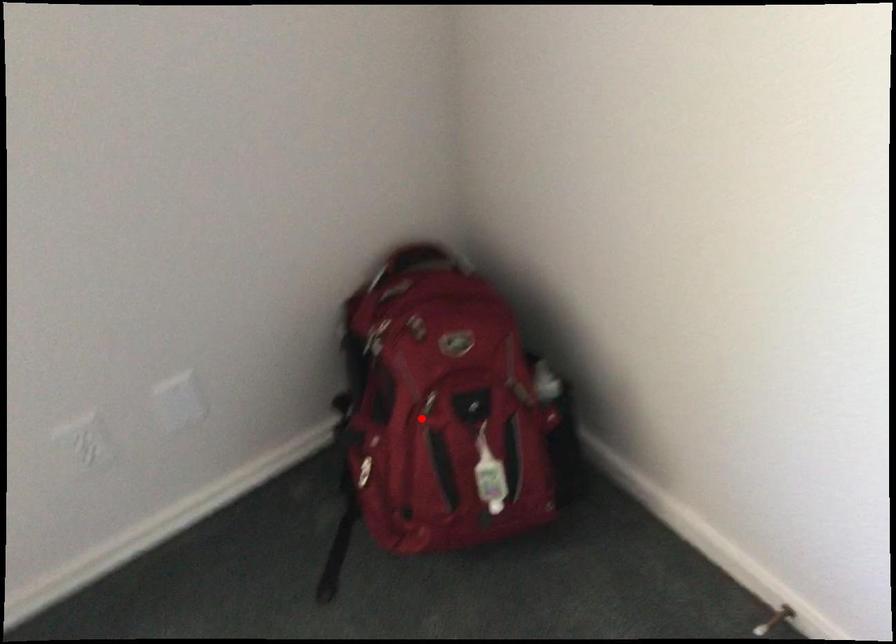
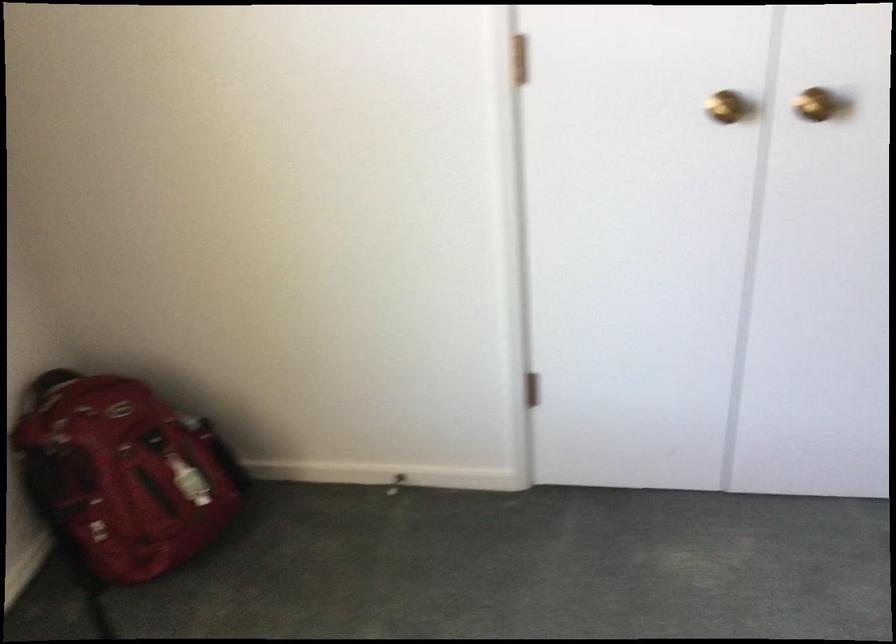
Question: I am providing you with two images of the same scene from different viewpoints. In image1, a red point is highlighted. Considering the same 3D point in image2, which of the following is correct?

Choices:
 (A) It is closer
 (B) It is farther

Answer: (B)